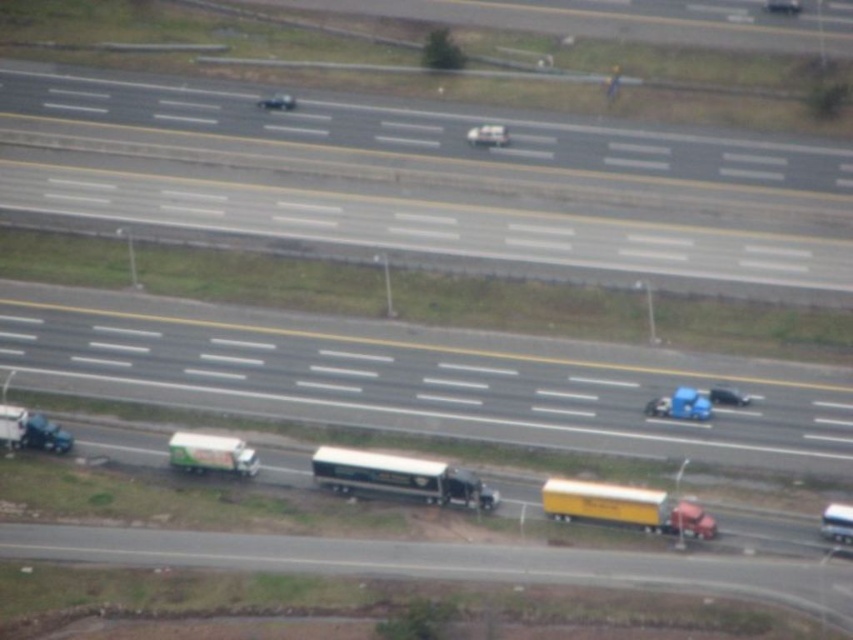
Question: Which object appears farthest from the camera in this image?

Choices:
 (A) shiny blue sedan at right
 (B) white matte truck at center

Answer: (A)

Question: From the image, what is the correct spatial relationship of yellow matte truck at lower right in relation to blue matte truck at center?

Choices:
 (A) right
 (B) left

Answer: (B)

Question: Is matte black truck at lower left behind metallic silver car at lower right?

Choices:
 (A) no
 (B) yes

Answer: (B)

Question: Estimate the real-world distances between objects in this image. Which object is farther from the matte black truck at lower left?

Choices:
 (A) shiny blue sedan at right
 (B) shiny silver sedan at center
 (C) blue matte truck at center
 (D) shiny black car at center

Answer: (D)

Question: Which object is positioned closest to the green matte truck at center?

Choices:
 (A) yellow matte truck at lower right
 (B) smooth asphalt highway at upper center
 (C) metallic silver car at lower right
 (D) shiny black car at center

Answer: (A)

Question: Is metallic silver car at lower right positioned before shiny blue sedan at right?

Choices:
 (A) no
 (B) yes

Answer: (B)